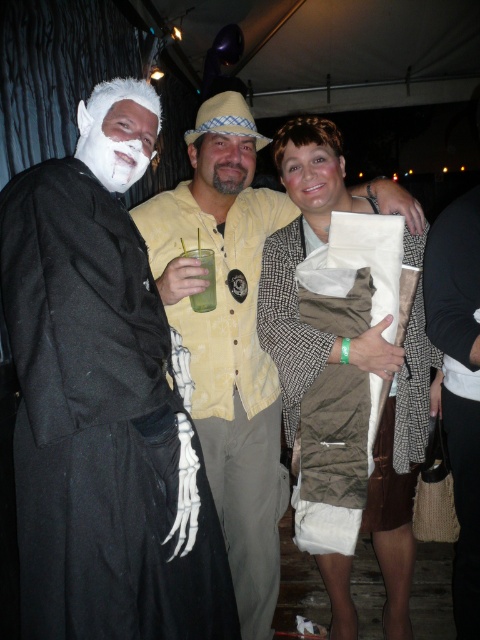
Question: From the image, what is the correct spatial relationship of matte black coat at left in relation to smooth skin face at center?

Choices:
 (A) below
 (B) above

Answer: (A)

Question: Estimate the real-world distances between objects in this image. Which object is closer to the smooth skin face at center?

Choices:
 (A) matte black coat at left
 (B) beige fabric face at center
 (C) white matte face at center
 (D) green translucent plastic cup at center

Answer: (B)

Question: Which object is positioned closest to the white matte face at center?

Choices:
 (A) beige fabric face at center
 (B) matte brown paper bag at center
 (C) matte black coat at left

Answer: (A)

Question: Based on their relative distances, which object is farther from the matte black coat at left?

Choices:
 (A) smooth skin face at center
 (B) white matte face at center
 (C) beige fabric face at center

Answer: (A)

Question: Does matte black coat at left have a lesser width compared to green translucent plastic cup at center?

Choices:
 (A) yes
 (B) no

Answer: (B)

Question: Does white matte face at center have a smaller size compared to green translucent plastic cup at center?

Choices:
 (A) yes
 (B) no

Answer: (B)